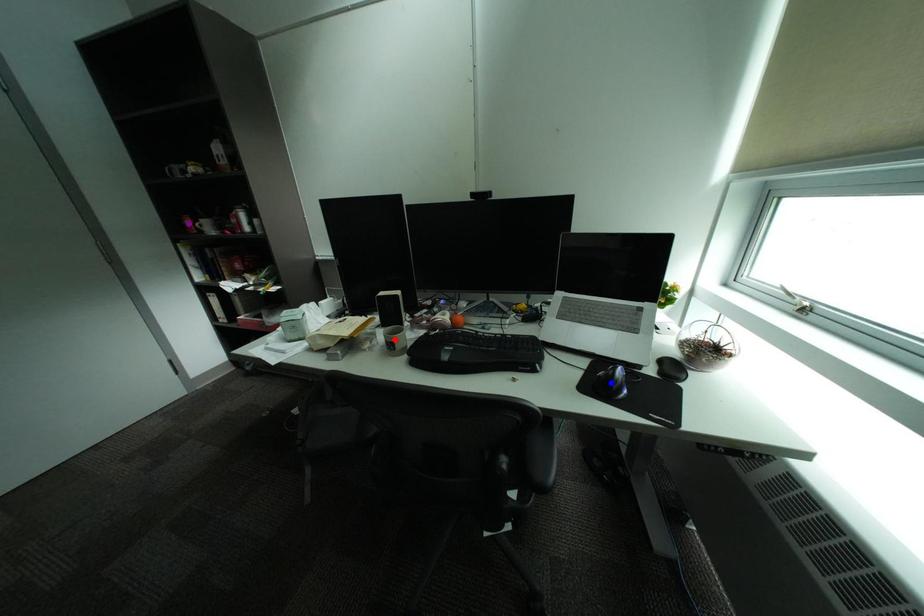
Order these from nearest to farthest:
1. blue point
2. purple point
3. red point

1. blue point
2. red point
3. purple point